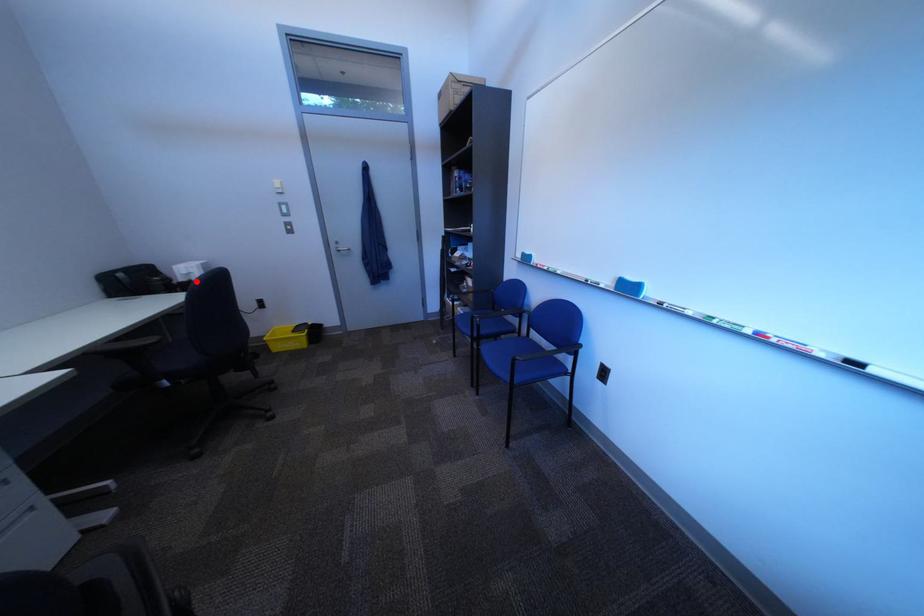
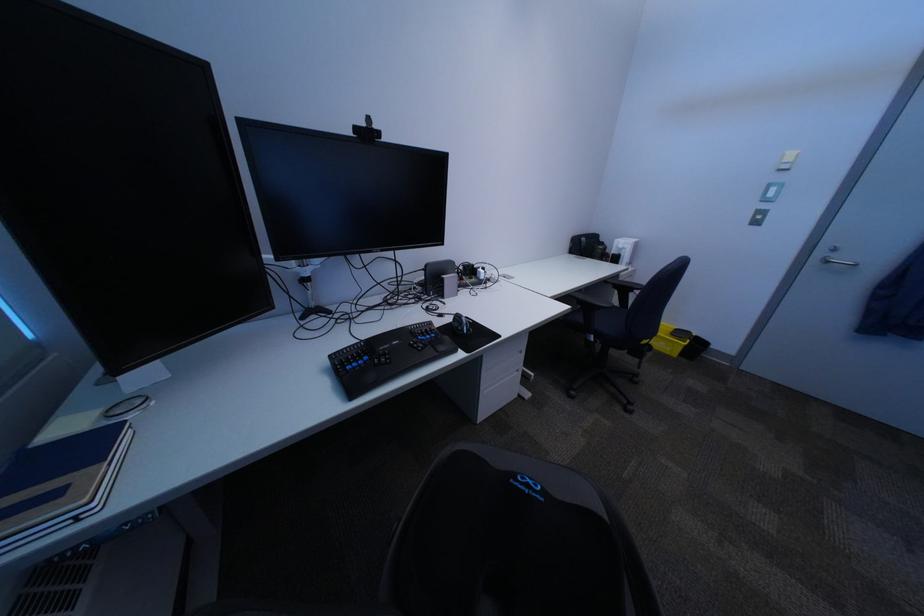
Question: I am providing you with two images of the same scene from different viewpoints. In image1, a red point is highlighted. Considering the same 3D point in image2, which of the following is correct?

Choices:
 (A) It is closer
 (B) It is farther

Answer: (A)